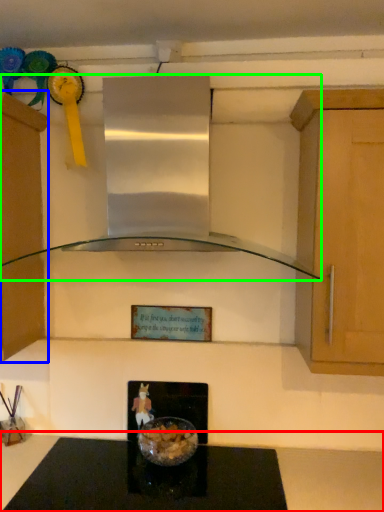
Question: Based on their relative distances, which object is nearer to countertop (highlighted by a red box)? Choose from cabinetry (highlighted by a blue box) and home appliance (highlighted by a green box).

Choices:
 (A) cabinetry
 (B) home appliance

Answer: (B)